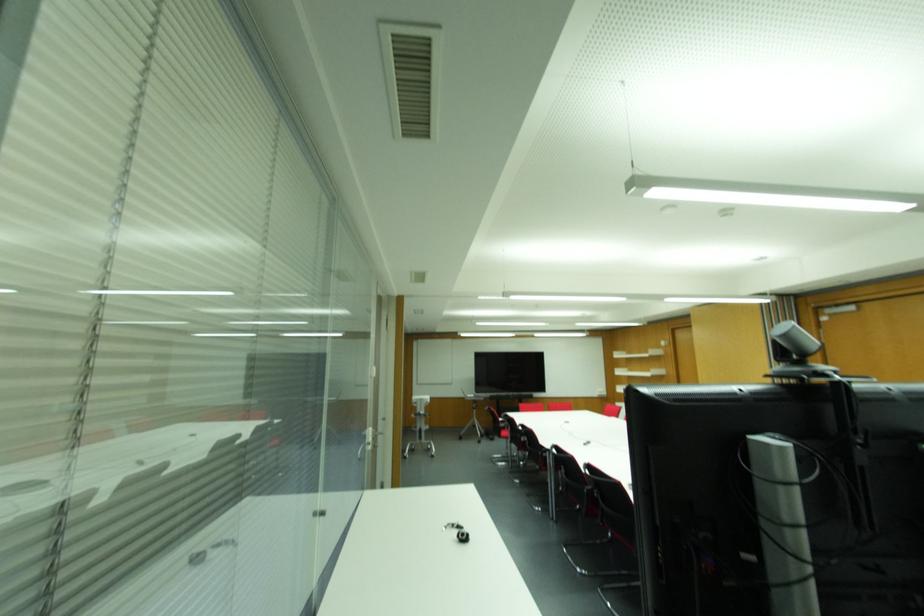
What do you see at coordinates (472, 416) in the screenshot? I see `the rolling metal stand` at bounding box center [472, 416].